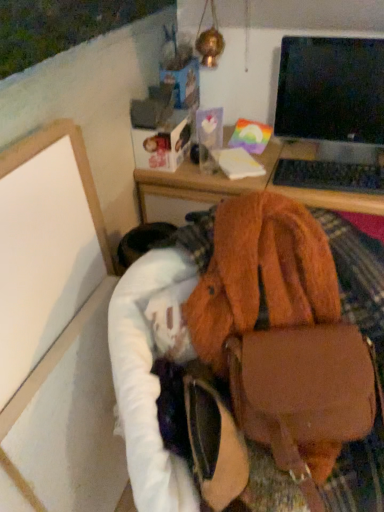
Image resolution: width=384 pixels, height=512 pixels. What are the coordinates of `black plastic keyboard at upper right` in the screenshot? It's located at (330, 176).

Locate an element on the screen. brown leather handbag at lower right is located at coordinates (280, 331).

The height and width of the screenshot is (512, 384). Find the location of `black glossy monitor at upper right`. black glossy monitor at upper right is located at coordinates (331, 89).

Find the location of a particular element. This screenshot has height=512, width=384. computer monitor above the brown leather handbag at lower right (from the image's perspective) is located at coordinates (331, 89).

Looking at this image, from the image's perspective, is brown leather handbag at lower right under black glossy monitor at upper right?

Yes, from the image's perspective, brown leather handbag at lower right is beneath black glossy monitor at upper right.

Between brown leather handbag at lower right and black glossy monitor at upper right, which one has smaller size?

black glossy monitor at upper right.

Locate an element on the screen. This screenshot has height=512, width=384. computer monitor lying above the white matte board at lower left (from the image's perspective) is located at coordinates (331, 89).

Is black glossy monitor at upper right at the left side of white matte board at lower left?

In fact, black glossy monitor at upper right is to the right of white matte board at lower left.

Looking at this image, is black glossy monitor at upper right oriented away from white matte board at lower left?

No, white matte board at lower left is not at the back of black glossy monitor at upper right.

Which object is closer to the camera taking this photo, black glossy monitor at upper right or white matte board at lower left?

white matte board at lower left is in front.

From the image's perspective, relative to black plastic keyboard at upper right, is black glossy monitor at upper right above or below?

Based on their image positions, black glossy monitor at upper right is located above black plastic keyboard at upper right.

Looking at this image, can we say black glossy monitor at upper right lies outside black plastic keyboard at upper right?

black glossy monitor at upper right is positioned outside black plastic keyboard at upper right.

In the scene shown: Is black glossy monitor at upper right directly adjacent to black plastic keyboard at upper right?

No, black glossy monitor at upper right is not making contact with black plastic keyboard at upper right.

Does black glossy monitor at upper right appear on the right side of black plastic keyboard at upper right?

No.

Considering the positions of objects white matte board at lower left and brown leather handbag at lower right in the image provided, who is in front, white matte board at lower left or brown leather handbag at lower right?

Positioned in front is brown leather handbag at lower right.

Can you tell me how much white matte board at lower left and brown leather handbag at lower right differ in facing direction?

The facing directions of white matte board at lower left and brown leather handbag at lower right are 51 degrees apart.

Locate an element on the screen. This screenshot has width=384, height=512. bulletin board that is behind the brown leather handbag at lower right is located at coordinates (45, 245).

Does black plastic keyboard at upper right come behind white matte board at lower left?

That is True.

Based on the photo, considering the relative positions of black plastic keyboard at upper right and white matte board at lower left in the image provided, is black plastic keyboard at upper right to the left or to the right of white matte board at lower left?

Clearly, black plastic keyboard at upper right is on the right of white matte board at lower left in the image.

Is black plastic keyboard at upper right not close to white matte board at lower left?

They are positioned close to each other.

The height and width of the screenshot is (512, 384). In order to click on bulletin board below the black plastic keyboard at upper right (from the image's perspective) in this screenshot , I will do `click(45, 245)`.

Is black plastic keyboard at upper right wider than brown leather handbag at lower right?

No.

Is the depth of black plastic keyboard at upper right greater than that of brown leather handbag at lower right?

Yes, black plastic keyboard at upper right is behind brown leather handbag at lower right.

From the image's perspective, does black plastic keyboard at upper right appear lower than brown leather handbag at lower right?

Actually, black plastic keyboard at upper right appears above brown leather handbag at lower right in the image.

From the image's perspective, who appears lower, white matte board at lower left or black plastic keyboard at upper right?

white matte board at lower left.

Does white matte board at lower left lie behind black plastic keyboard at upper right?

No, white matte board at lower left is closer to the viewer.

Is white matte board at lower left facing away from black plastic keyboard at upper right?

white matte board at lower left is not turned away from black plastic keyboard at upper right.

Can you confirm if white matte board at lower left is taller than black plastic keyboard at upper right?

Correct, white matte board at lower left is much taller as black plastic keyboard at upper right.

Locate an element on the screen. Image resolution: width=384 pixels, height=512 pixels. handbag directly beneath the black glossy monitor at upper right (from a real-world perspective) is located at coordinates (280, 331).

Where is `bulletin board below the black glossy monitor at upper right (from the image's perspective)`? This screenshot has height=512, width=384. bulletin board below the black glossy monitor at upper right (from the image's perspective) is located at coordinates (45, 245).

When comparing their distances from brown leather handbag at lower right, does white matte board at lower left or black glossy monitor at upper right seem further?

The object further to brown leather handbag at lower right is black glossy monitor at upper right.

From the image, which object appears to be nearer to black plastic keyboard at upper right, brown leather handbag at lower right or black glossy monitor at upper right?

black glossy monitor at upper right is closer to black plastic keyboard at upper right.

Considering their positions, is black plastic keyboard at upper right positioned further to white matte board at lower left than black glossy monitor at upper right?

The object further to white matte board at lower left is black glossy monitor at upper right.

Estimate the real-world distances between objects in this image. Which object is further from black glossy monitor at upper right, black plastic keyboard at upper right or white matte board at lower left?

The object further to black glossy monitor at upper right is white matte board at lower left.

When comparing their distances from white matte board at lower left, does brown leather handbag at lower right or black plastic keyboard at upper right seem further?

Based on the image, black plastic keyboard at upper right appears to be further to white matte board at lower left.

Which object lies further to the anchor point black glossy monitor at upper right, black plastic keyboard at upper right or brown leather handbag at lower right?

brown leather handbag at lower right.

Based on their spatial positions, is brown leather handbag at lower right or black glossy monitor at upper right closer to white matte board at lower left?

brown leather handbag at lower right lies closer to white matte board at lower left than the other object.

Looking at this image, based on their spatial positions, is black glossy monitor at upper right or black plastic keyboard at upper right closer to white matte board at lower left?

black plastic keyboard at upper right.

The width and height of the screenshot is (384, 512). In order to click on bulletin board between brown leather handbag at lower right and black plastic keyboard at upper right from front to back in this screenshot , I will do `click(45, 245)`.

Locate an element on the screen. The width and height of the screenshot is (384, 512). computer monitor between brown leather handbag at lower right and black plastic keyboard at upper right from front to back is located at coordinates (331, 89).

Locate an element on the screen. The height and width of the screenshot is (512, 384). bulletin board between black glossy monitor at upper right and brown leather handbag at lower right in the up-down direction is located at coordinates (45, 245).

Where is `computer monitor between white matte board at lower left and black plastic keyboard at upper right in the horizontal direction`? The height and width of the screenshot is (512, 384). computer monitor between white matte board at lower left and black plastic keyboard at upper right in the horizontal direction is located at coordinates (331, 89).